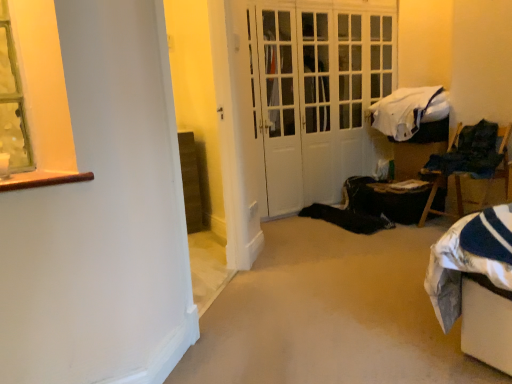
Question: Does white soft blanket at upper right lie behind wooden chair at right?

Choices:
 (A) yes
 (B) no

Answer: (A)

Question: Is white soft blanket at upper right closer to the viewer compared to wooden chair at right?

Choices:
 (A) yes
 (B) no

Answer: (B)

Question: From a real-world perspective, is white soft blanket at upper right on wooden chair at right?

Choices:
 (A) yes
 (B) no

Answer: (A)

Question: Can you confirm if white soft blanket at upper right is wider than wooden chair at right?

Choices:
 (A) no
 (B) yes

Answer: (B)

Question: Considering the relative sizes of white soft blanket at upper right and wooden chair at right in the image provided, is white soft blanket at upper right shorter than wooden chair at right?

Choices:
 (A) yes
 (B) no

Answer: (A)

Question: From the image's perspective, is white soft blanket at upper right located beneath wooden chair at right?

Choices:
 (A) no
 (B) yes

Answer: (A)

Question: Does black fabric bag at lower right have a lesser height compared to wooden chair at right?

Choices:
 (A) no
 (B) yes

Answer: (B)

Question: From the image's perspective, does black fabric bag at lower right appear lower than wooden chair at right?

Choices:
 (A) no
 (B) yes

Answer: (B)

Question: Does black fabric bag at lower right have a lesser width compared to wooden chair at right?

Choices:
 (A) yes
 (B) no

Answer: (B)

Question: Does black fabric bag at lower right have a larger size compared to wooden chair at right?

Choices:
 (A) yes
 (B) no

Answer: (B)

Question: Is black fabric bag at lower right positioned far away from wooden chair at right?

Choices:
 (A) no
 (B) yes

Answer: (A)

Question: Would you say black fabric bag at lower right is outside wooden chair at right?

Choices:
 (A) yes
 (B) no

Answer: (A)

Question: Is wooden chair at right completely or partially outside of black fabric bag at lower right?

Choices:
 (A) yes
 (B) no

Answer: (A)